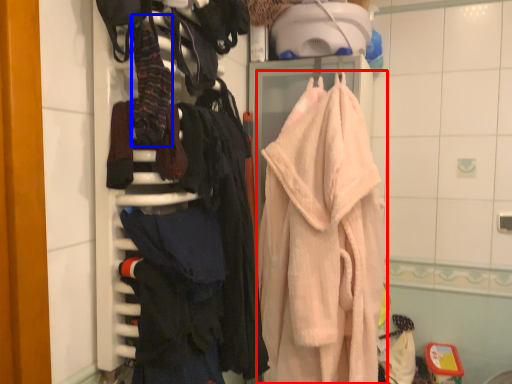
Question: Among these objects, which one is nearest to the camera, towel (highlighted by a red box) or clothing (highlighted by a blue box)?

Choices:
 (A) towel
 (B) clothing

Answer: (B)